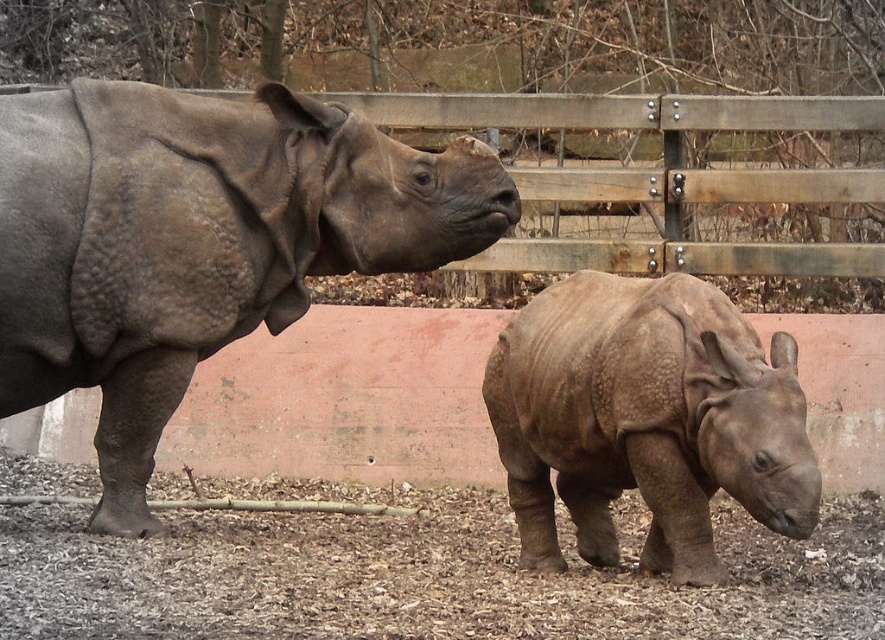
Question: Which of the following is the farthest from the observer?

Choices:
 (A) matte gray rhino at center
 (B) gray textured rhino at left

Answer: (B)

Question: Is gray textured rhino at left further to the viewer compared to matte gray rhino at center?

Choices:
 (A) no
 (B) yes

Answer: (B)

Question: Is gray textured rhino at left further to camera compared to matte gray rhino at center?

Choices:
 (A) yes
 (B) no

Answer: (A)

Question: Is the position of gray textured rhino at left less distant than that of matte gray rhino at center?

Choices:
 (A) no
 (B) yes

Answer: (A)

Question: Which of the following is the farthest from the observer?

Choices:
 (A) (314, 120)
 (B) (785, 451)

Answer: (A)